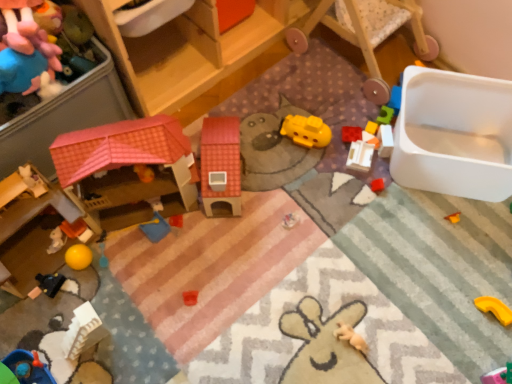
This screenshot has height=384, width=512. I want to click on vacant area located to the right-hand side of light brown plush toy at lower right, the sixth toy from the right, so click(x=407, y=329).